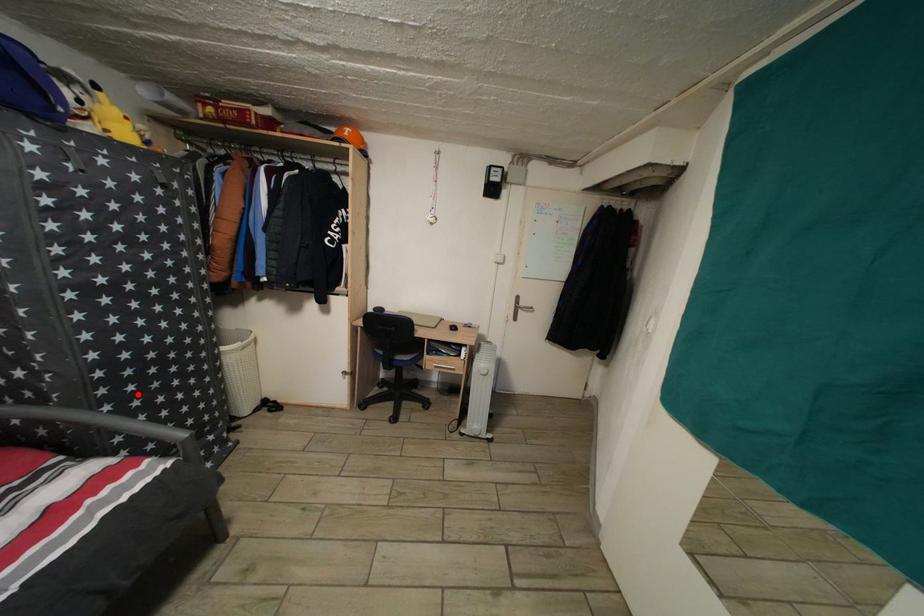
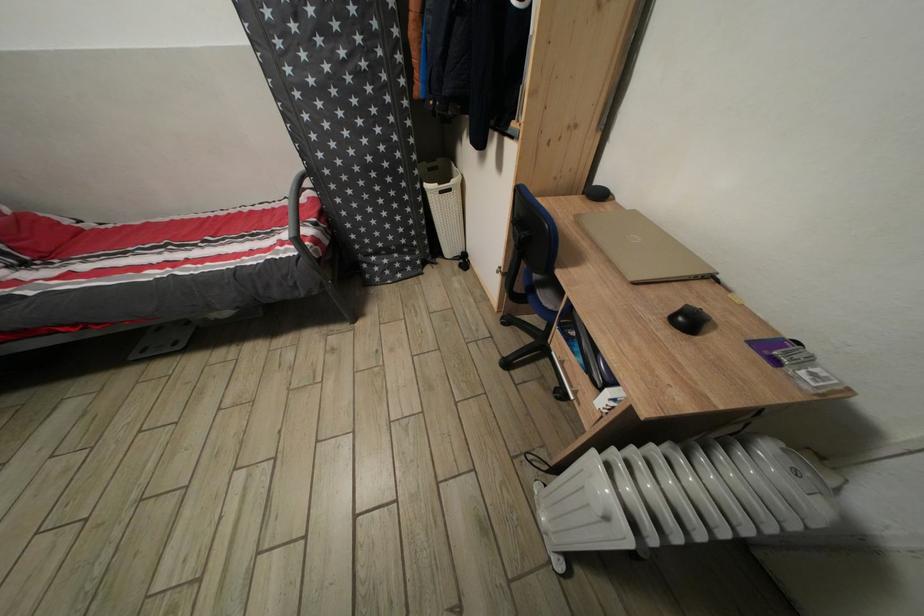
Locate, in the second image, the point that corresponds to the highlighted location in the first image.

(357, 198)